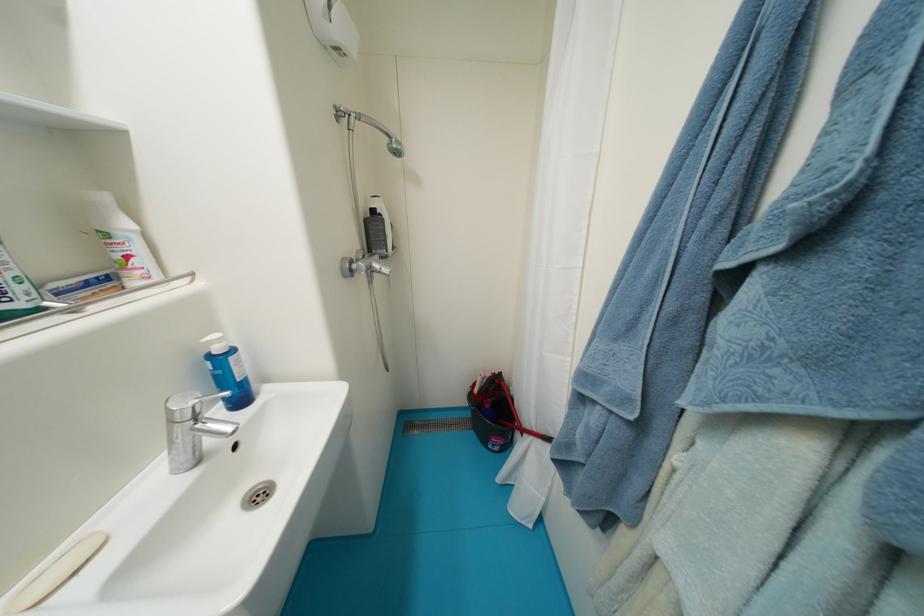
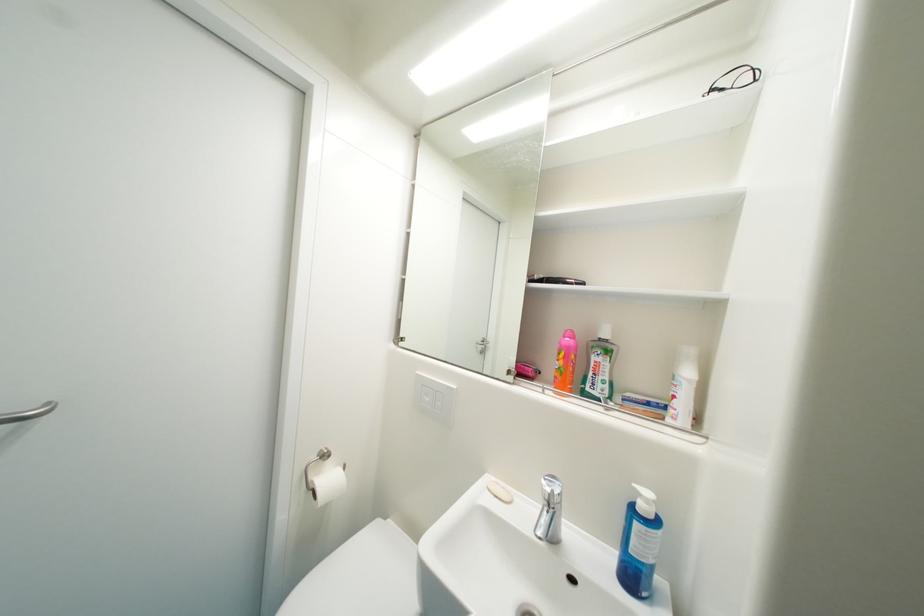
In the second image, find the point that corresponds to [215,359] in the first image.

(641, 507)